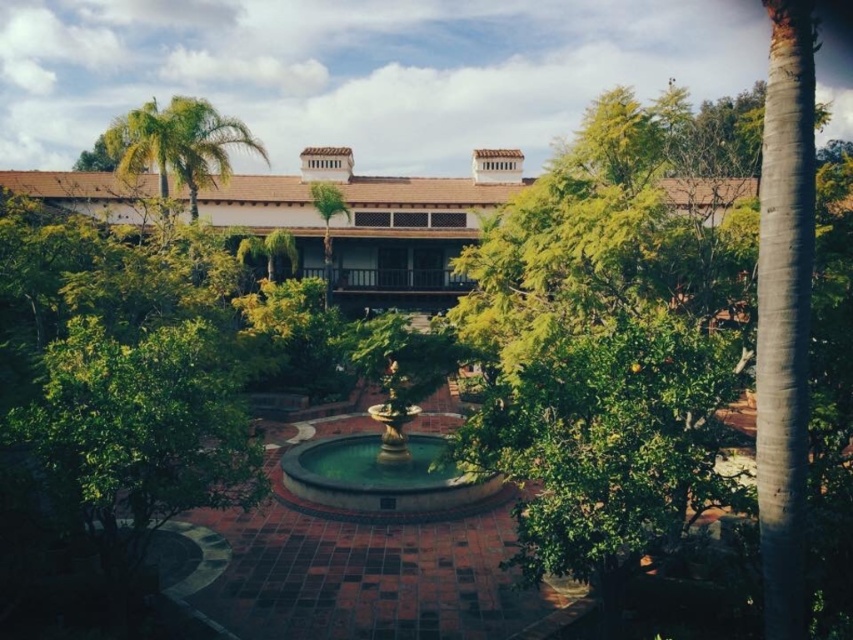
Question: Which of the following is the closest to the observer?

Choices:
 (A) gold metallic fountain at center
 (B) brown tile roof at upper center
 (C) green leafy palm tree at upper left

Answer: (B)

Question: Among these objects, which one is nearest to the camera?

Choices:
 (A) gold metallic fountain at center
 (B) brown tile roof at upper center

Answer: (B)

Question: Estimate the real-world distances between objects in this image. Which object is farther from the gold metallic fountain at center?

Choices:
 (A) green leafy palm tree at upper left
 (B) brown tile roof at upper center

Answer: (B)

Question: Is brown tile roof at upper center further to camera compared to green leafy palm tree at upper left?

Choices:
 (A) no
 (B) yes

Answer: (A)

Question: Can you confirm if brown tile roof at upper center is positioned below green leafy palm tree at upper left?

Choices:
 (A) yes
 (B) no

Answer: (A)

Question: Can you confirm if brown tile roof at upper center is bigger than green leafy palm tree at upper left?

Choices:
 (A) yes
 (B) no

Answer: (A)